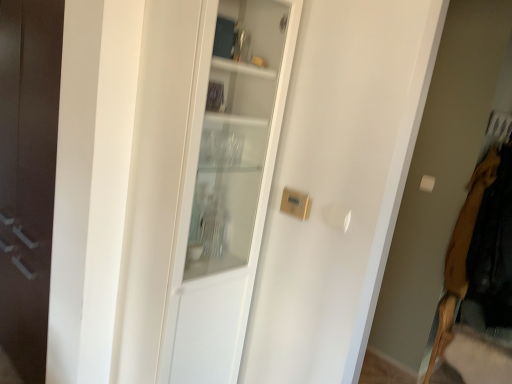
What is the approximate height of white glass cabinet at center?

white glass cabinet at center is 5.45 feet in height.

The image size is (512, 384). I want to click on white glass cabinet at center, so click(227, 186).

Describe the element at coordinates (227, 186) in the screenshot. I see `white glass cabinet at center` at that location.

Looking at this image, measure the distance between point (225, 89) and camera.

Point (225, 89) is 5.38 feet from camera.

Measure the distance between point (481, 274) and camera.

They are 7.98 feet apart.

This screenshot has width=512, height=384. Describe the element at coordinates (490, 248) in the screenshot. I see `velvet brown coat at right` at that location.

Locate an element on the screen. velvet brown coat at right is located at coordinates (490, 248).

Locate an element on the screen. white glass cabinet at center is located at coordinates (227, 186).

Between white glass cabinet at center and velvet brown coat at right, which one appears on the right side from the viewer's perspective?

Positioned to the right is velvet brown coat at right.

Considering the positions of objects white glass cabinet at center and velvet brown coat at right in the image provided, who is behind, white glass cabinet at center or velvet brown coat at right?

velvet brown coat at right is further away from the camera.

Is point (177, 244) in front of point (478, 294)?

Yes, point (177, 244) is in front of point (478, 294).

From the image's perspective, relative to velvet brown coat at right, is white glass cabinet at center above or below?

white glass cabinet at center is situated higher than velvet brown coat at right in the image.

From a real-world perspective, is white glass cabinet at center positioned above or below velvet brown coat at right?

Clearly, from a real-world perspective, white glass cabinet at center is above velvet brown coat at right.

Can you confirm if white glass cabinet at center is wider than velvet brown coat at right?

No, white glass cabinet at center is not wider than velvet brown coat at right.

Who is shorter, white glass cabinet at center or velvet brown coat at right?

With less height is velvet brown coat at right.

Is white glass cabinet at center bigger than velvet brown coat at right?

Incorrect, white glass cabinet at center is not larger than velvet brown coat at right.

Is velvet brown coat at right completely or partially inside white glass cabinet at center?

No, velvet brown coat at right is not a part of white glass cabinet at center.

Is white glass cabinet at center far away from velvet brown coat at right?

Yes, white glass cabinet at center and velvet brown coat at right are quite far apart.

Is white glass cabinet at center oriented towards velvet brown coat at right?

No, white glass cabinet at center is not oriented towards velvet brown coat at right.

How many degrees apart are the facing directions of white glass cabinet at center and velvet brown coat at right?

0.17 degrees separate the facing orientations of white glass cabinet at center and velvet brown coat at right.

Find the location of a particular element. The height and width of the screenshot is (384, 512). cabinetry that appears above the velvet brown coat at right (from the image's perspective) is located at coordinates tap(227, 186).

Can you confirm if velvet brown coat at right is positioned to the right of white glass cabinet at center?

Yes, velvet brown coat at right is to the right of white glass cabinet at center.

Considering the positions of objects velvet brown coat at right and white glass cabinet at center in the image provided, who is in front, velvet brown coat at right or white glass cabinet at center?

white glass cabinet at center.

Considering the positions of points (505, 315) and (274, 132), is point (505, 315) closer to camera compared to point (274, 132)?

That is False.

From the image's perspective, which one is positioned lower, velvet brown coat at right or white glass cabinet at center?

velvet brown coat at right, from the image's perspective.

From a real-world perspective, who is located lower, velvet brown coat at right or white glass cabinet at center?

velvet brown coat at right is physically lower.

Can you confirm if velvet brown coat at right is wider than white glass cabinet at center?

Yes.

Considering the sizes of objects velvet brown coat at right and white glass cabinet at center in the image provided, who is taller, velvet brown coat at right or white glass cabinet at center?

With more height is white glass cabinet at center.

Can you confirm if velvet brown coat at right is smaller than white glass cabinet at center?

No, velvet brown coat at right is not smaller than white glass cabinet at center.

Is white glass cabinet at center surrounded by velvet brown coat at right?

No, white glass cabinet at center is located outside of velvet brown coat at right.

Is velvet brown coat at right next to white glass cabinet at center and touching it?

No, velvet brown coat at right is not with white glass cabinet at center.

Based on the photo, could you tell me if velvet brown coat at right is turned towards white glass cabinet at center?

No, velvet brown coat at right is not turned towards white glass cabinet at center.

What's the angular difference between velvet brown coat at right and white glass cabinet at center's facing directions?

The angular difference between velvet brown coat at right and white glass cabinet at center is 0.17 degrees.

Find the location of a particular element. This screenshot has width=512, height=384. clothing that is below the white glass cabinet at center (from the image's perspective) is located at coordinates (490, 248).

Find the location of `cabinetry above the velvet brown coat at right (from the image's perspective)`. cabinetry above the velvet brown coat at right (from the image's perspective) is located at coordinates (227, 186).

Locate an element on the screen. The height and width of the screenshot is (384, 512). clothing below the white glass cabinet at center (from a real-world perspective) is located at coordinates (490, 248).